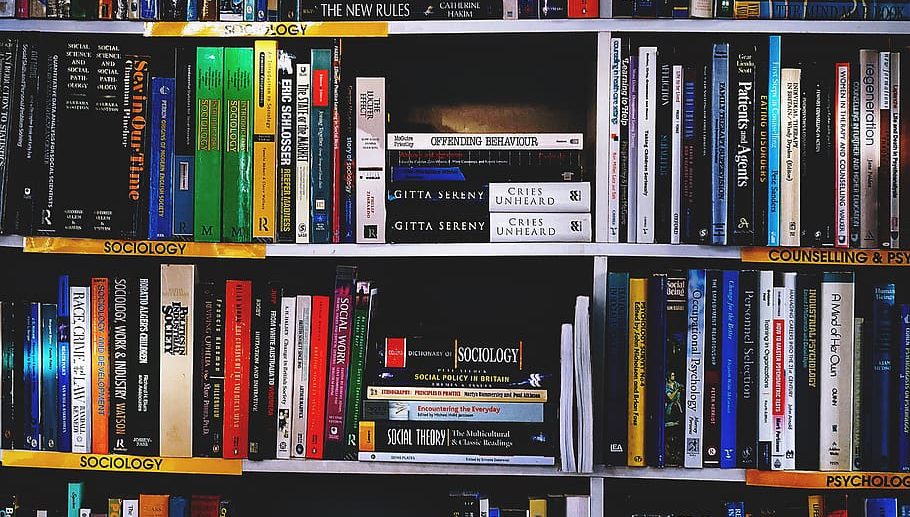
The width and height of the screenshot is (910, 517). What are the coordinates of `shelf` in the screenshot? It's located at (289, 464).